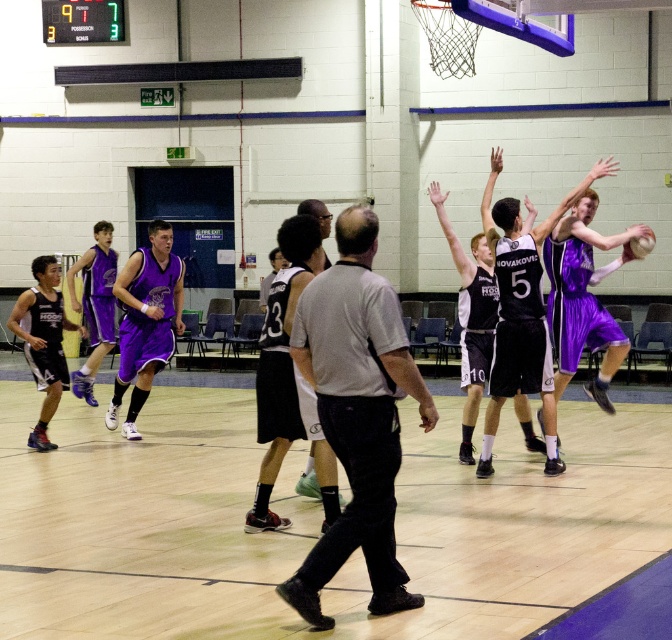
Who is more distant from viewer, (384,289) or (646,253)?

Point (646,253)

From the picture: Is gray shirt at center thinner than rubber textured basketball at center?

No.

This screenshot has height=640, width=672. Find the location of `gray shirt at center`. gray shirt at center is located at coordinates (355, 413).

Does gray shirt at center have a greater width compared to purple matte basketball at center?

Incorrect, gray shirt at center's width does not surpass purple matte basketball at center's.

Is gray shirt at center shorter than purple matte basketball at center?

Correct, gray shirt at center is not as tall as purple matte basketball at center.

Which is in front, point (345, 406) or point (163, 250)?

Point (345, 406) is in front.

At what (x,y) coordinates should I click in order to perform the action: click on gray shirt at center. Please return your answer as a coordinate pair (x, y). Image resolution: width=672 pixels, height=640 pixels. Looking at the image, I should click on (355, 413).

This screenshot has width=672, height=640. What do you see at coordinates (144, 321) in the screenshot?
I see `purple matte basketball at center` at bounding box center [144, 321].

Looking at this image, who is lower down, purple matte basketball at center or rubber textured basketball at center?

purple matte basketball at center is below.

The image size is (672, 640). Find the location of `purple matte basketball at center`. purple matte basketball at center is located at coordinates (144, 321).

Identify the location of purple matte basketball at center. (144, 321).